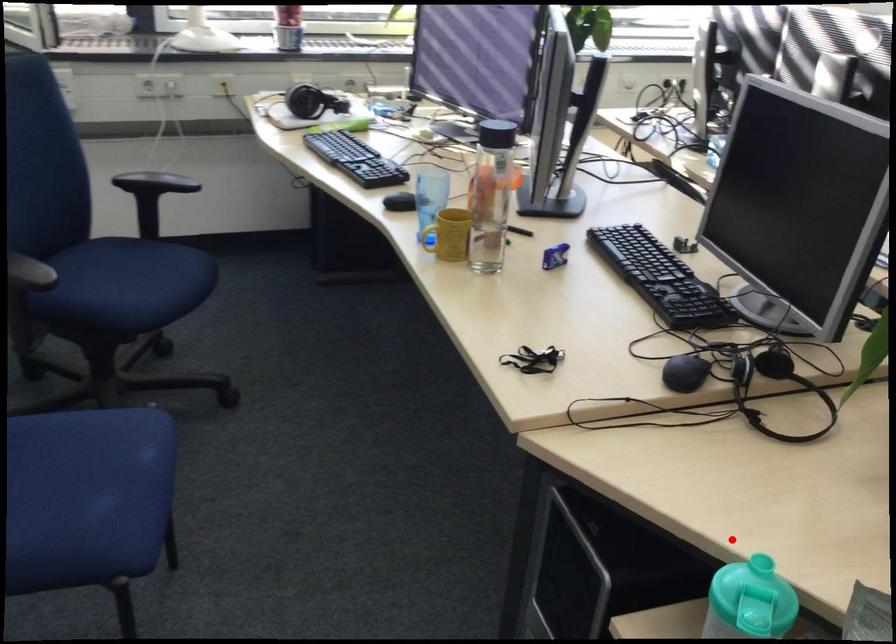
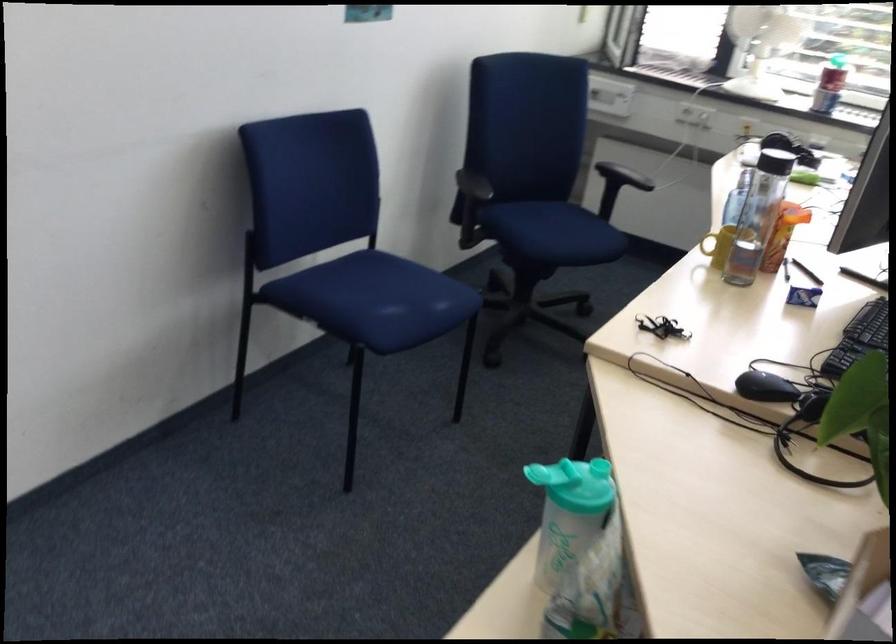
Question: I am providing you with two images of the same scene from different viewpoints. Image1 has a red point marked. In image2, the corresponding 3D location appears at what relative position? Reply with the corresponding letter.

Choices:
 (A) Closer
 (B) Farther

Answer: (B)